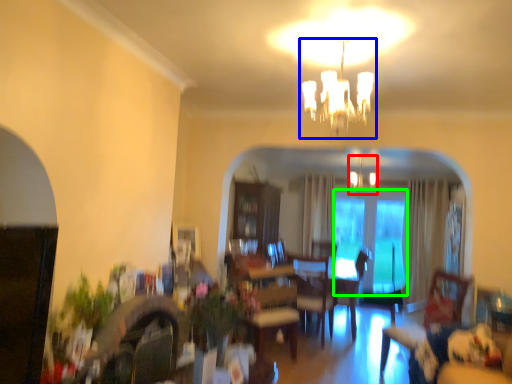
Question: Estimate the real-world distances between objects in this image. Which object is closer to fixture (highlighted by a red box), light fixture (highlighted by a blue box) or glass door (highlighted by a green box)?

Choices:
 (A) light fixture
 (B) glass door

Answer: (B)